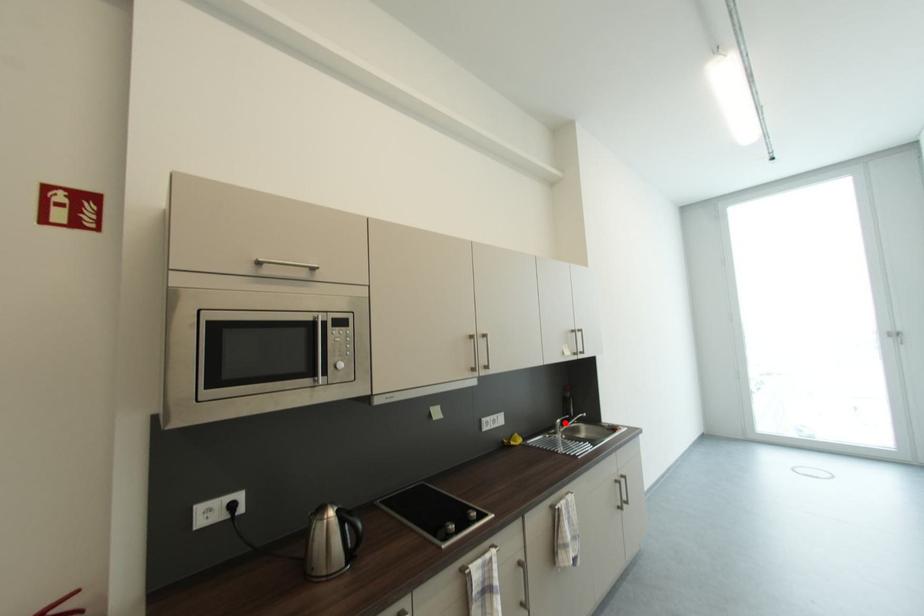
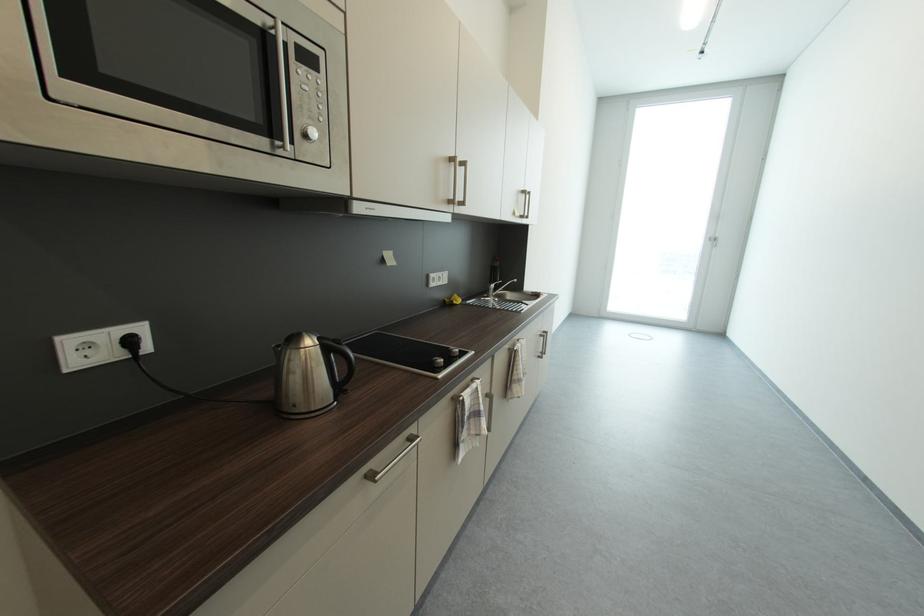
Where in the second image is the point corresponding to the highlighted location from the first image?

(499, 286)